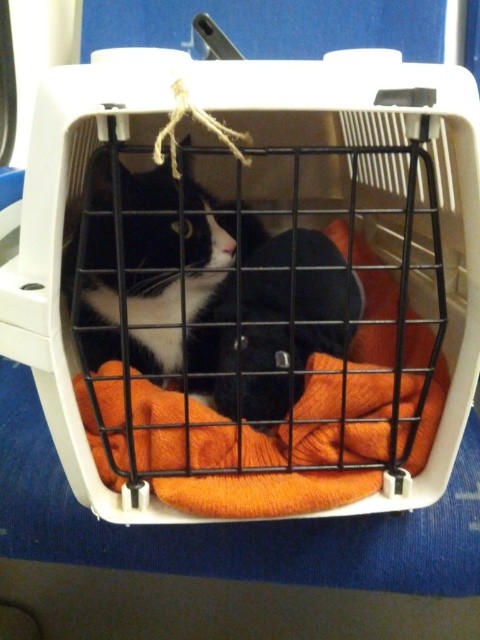
Question: Does orange knitted laundry basket at center appear under black matte fur cat at center?

Choices:
 (A) no
 (B) yes

Answer: (A)

Question: Which point is closer to the camera?

Choices:
 (A) black matte fur cat at center
 (B) orange knitted laundry basket at center

Answer: (B)

Question: Is orange knitted laundry basket at center below black matte fur cat at center?

Choices:
 (A) yes
 (B) no

Answer: (B)

Question: Can you confirm if orange knitted laundry basket at center is positioned below black matte fur cat at center?

Choices:
 (A) no
 (B) yes

Answer: (A)